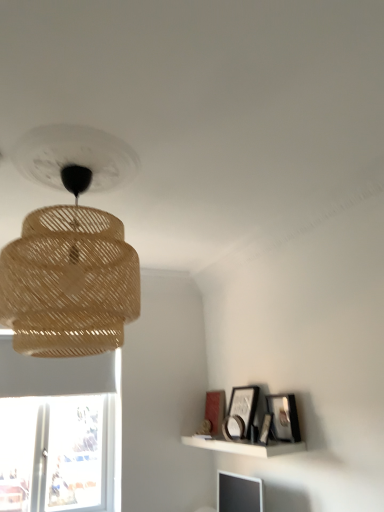
Question: Is matte black picture frame at lower right, arranged as the 1th picture frame when viewed from the front, located outside matte black picture frame at upper right, positioned as the 4th picture frame in front-to-back order?

Choices:
 (A) no
 (B) yes

Answer: (B)

Question: Can you confirm if matte black picture frame at lower right, arranged as the fifth picture frame when viewed from the back, is wider than matte black picture frame at upper right, the 2th picture frame from the back?

Choices:
 (A) yes
 (B) no

Answer: (B)

Question: From a real-world perspective, does matte black picture frame at lower right, arranged as the 1th picture frame when viewed from the front, sit lower than matte black picture frame at upper right, the 2th picture frame from the back?

Choices:
 (A) yes
 (B) no

Answer: (A)

Question: Considering the relative sizes of matte black picture frame at lower right, arranged as the 1th picture frame when viewed from the front, and matte black picture frame at upper right, positioned as the 4th picture frame in front-to-back order, in the image provided, is matte black picture frame at lower right, arranged as the 1th picture frame when viewed from the front, bigger than matte black picture frame at upper right, positioned as the 4th picture frame in front-to-back order,?

Choices:
 (A) no
 (B) yes

Answer: (A)

Question: Can you confirm if matte black picture frame at lower right, arranged as the 1th picture frame when viewed from the front, is positioned to the right of matte black picture frame at upper right, the 2th picture frame from the back?

Choices:
 (A) yes
 (B) no

Answer: (A)

Question: Is matte black picture frame at lower right, arranged as the fifth picture frame when viewed from the back, placed right next to matte black picture frame at upper right, the 2th picture frame from the back?

Choices:
 (A) no
 (B) yes

Answer: (A)

Question: From the image's perspective, is wooden picture frame at upper right, placed as the 3th picture frame when sorted from front to back, on top of white matte shelf at lower right?

Choices:
 (A) yes
 (B) no

Answer: (A)

Question: Is wooden picture frame at upper right, placed as the 3th picture frame when sorted from front to back, to the left of white matte shelf at lower right from the viewer's perspective?

Choices:
 (A) yes
 (B) no

Answer: (A)

Question: From a real-world perspective, is wooden picture frame at upper right, placed as the 3th picture frame when sorted from front to back, positioned over white matte shelf at lower right based on gravity?

Choices:
 (A) no
 (B) yes

Answer: (B)

Question: From a real-world perspective, is wooden picture frame at upper right, placed as the 3th picture frame when sorted from front to back, below white matte shelf at lower right?

Choices:
 (A) no
 (B) yes

Answer: (A)

Question: Considering the relative sizes of wooden picture frame at upper right, placed as the 3th picture frame when sorted from front to back, and white matte shelf at lower right in the image provided, is wooden picture frame at upper right, placed as the 3th picture frame when sorted from front to back, wider than white matte shelf at lower right?

Choices:
 (A) yes
 (B) no

Answer: (B)

Question: Is wooden picture frame at upper right, placed as the 3th picture frame when sorted from front to back, aimed at white matte shelf at lower right?

Choices:
 (A) no
 (B) yes

Answer: (A)

Question: Does matte black picture frame at upper right, marked as the 1th picture frame in a back-to-front arrangement, come in front of matte black picture frame at upper right, the 2th picture frame from the back?

Choices:
 (A) no
 (B) yes

Answer: (A)